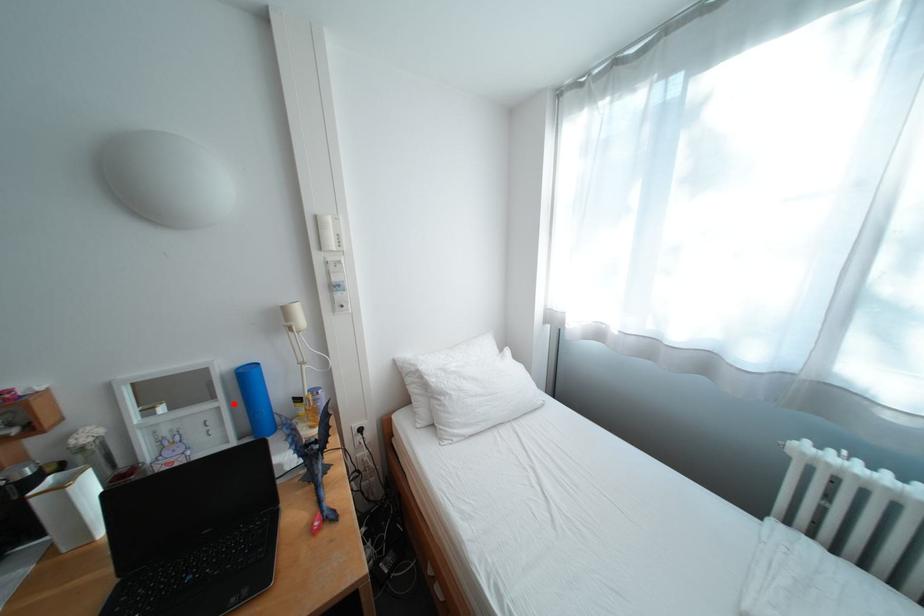
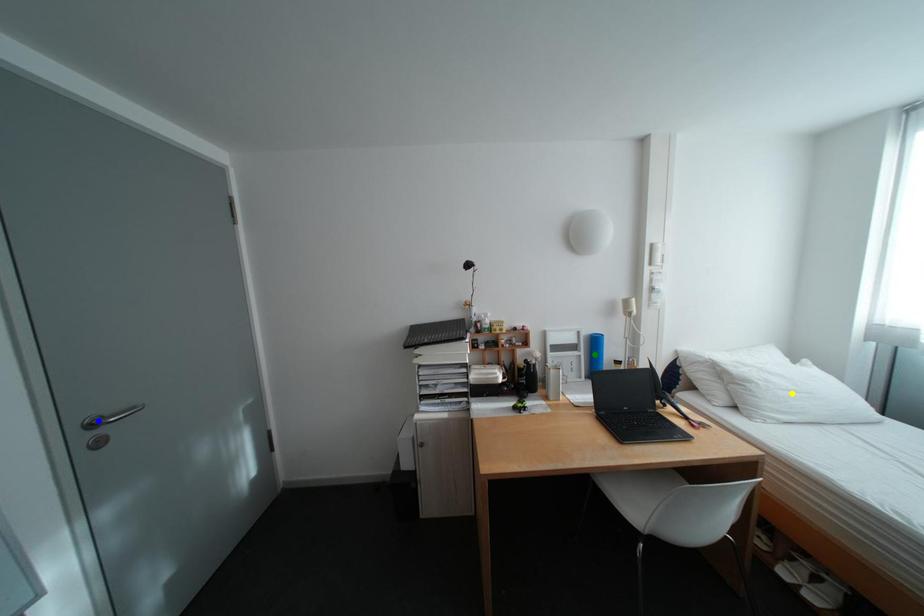
Question: I am providing you with two images of the same scene from different viewpoints. A red point is marked on the first image. You are given multiple points on the second image. Which point in image 2 is actually the same real-world point as the red point in image 1?

Choices:
 (A) green point
 (B) blue point
 (C) yellow point

Answer: (A)